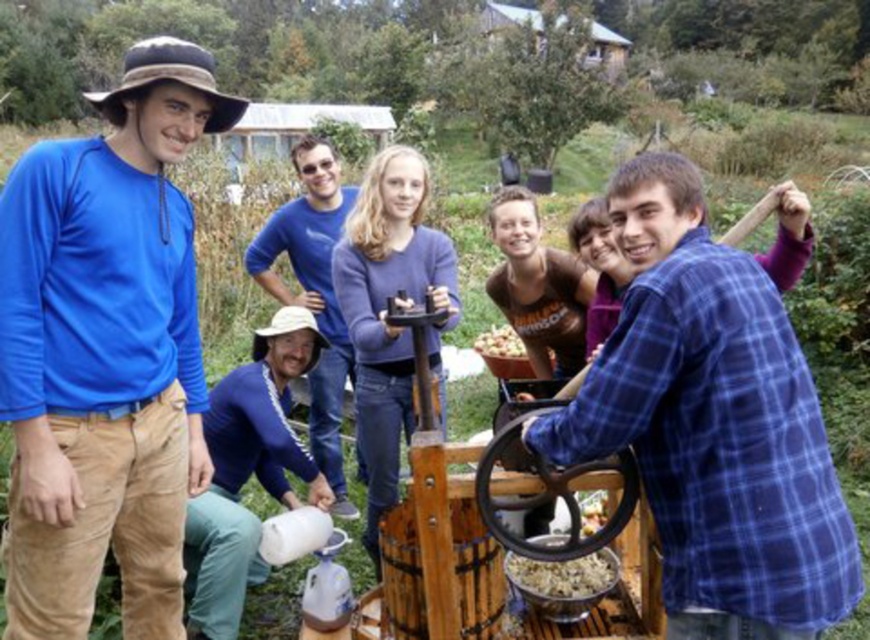
Is point (312, 412) behind point (583, 577)?

Yes.

Is blue cotton shirt at center above smooth brown flour at center?

Yes.

Locate an element on the screen. blue cotton shirt at center is located at coordinates (313, 292).

Does blue cotton shirt at upper left have a larger size compared to smooth brown nuts at center?

Yes.

Is blue cotton shirt at upper left taller than smooth brown nuts at center?

Yes.

The image size is (870, 640). I want to click on blue cotton shirt at upper left, so click(105, 353).

What do you see at coordinates (713, 424) in the screenshot? I see `blue plaid shirt at center` at bounding box center [713, 424].

Is point (817, 557) in front of point (490, 352)?

Yes.

Where is `blue plaid shirt at center`? blue plaid shirt at center is located at coordinates (713, 424).